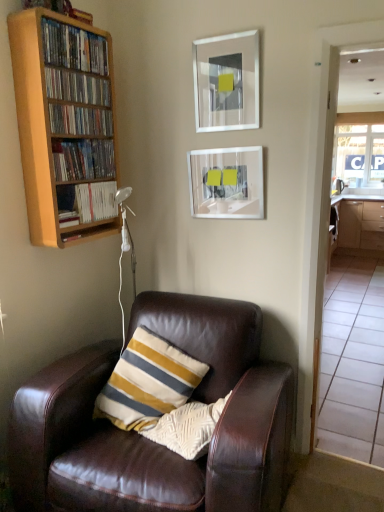
Question: From the image's perspective, is brown leather chair at lower left located above or below transparent glass window at right?

Choices:
 (A) below
 (B) above

Answer: (A)

Question: Is brown leather chair at lower left bigger or smaller than transparent glass window at right?

Choices:
 (A) big
 (B) small

Answer: (A)

Question: Which object is the farthest from the wooden bookshelf at upper left, the 2th book when ordered from bottom to top?

Choices:
 (A) matte glass picture frame at upper center, the second picture frame positioned from the top
 (B) wooden bookshelf at upper left, acting as the 5th book starting from the top
 (C) white glossy cabinetry at right
 (D) silver metallic picture frame at upper center, the second picture frame ordered from the bottom
 (E) transparent glass door at right

Answer: (C)

Question: Which object is positioned closest to the wooden bookshelf at upper left, acting as the 3th book starting from the bottom?

Choices:
 (A) transparent glass door at right
 (B) wooden bookcase at left
 (C) silver metallic picture frame at upper center, the second picture frame ordered from the bottom
 (D) wooden bookshelf at upper left, the 2th book when ordered from bottom to top
 (E) matte glass picture frame at upper center, the 1th picture frame ordered from the bottom

Answer: (D)